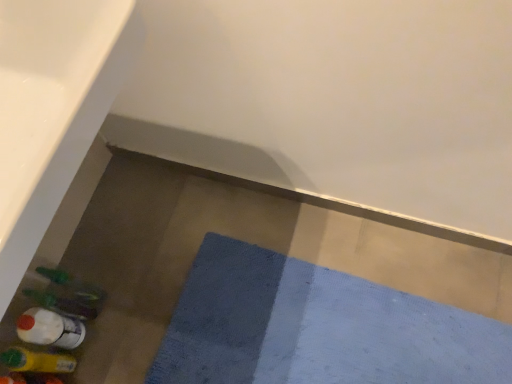
Question: Could you tell me if translucent plastic bottle at lower left, arranged as the first bottle when viewed from the top, is facing blue textured bath mat at lower center?

Choices:
 (A) no
 (B) yes

Answer: (A)

Question: Is translucent plastic bottle at lower left, the 3th bottle positioned from the bottom, taller than blue textured bath mat at lower center?

Choices:
 (A) no
 (B) yes

Answer: (B)

Question: From a real-world perspective, is translucent plastic bottle at lower left, the 3th bottle positioned from the bottom, on blue textured bath mat at lower center?

Choices:
 (A) no
 (B) yes

Answer: (B)

Question: Is translucent plastic bottle at lower left, arranged as the first bottle when viewed from the top, bigger than blue textured bath mat at lower center?

Choices:
 (A) no
 (B) yes

Answer: (A)

Question: Is translucent plastic bottle at lower left, the 3th bottle positioned from the bottom, to the right of blue textured bath mat at lower center from the viewer's perspective?

Choices:
 (A) yes
 (B) no

Answer: (B)

Question: From their relative heights in the image, would you say white glossy bath at lower left is taller or shorter than translucent plastic bottle at lower left, the second bottle when ordered from bottom to top?

Choices:
 (A) short
 (B) tall

Answer: (B)

Question: Is white glossy bath at lower left inside the boundaries of translucent plastic bottle at lower left, which is the second bottle from top to bottom, or outside?

Choices:
 (A) inside
 (B) outside

Answer: (B)

Question: Considering the positions of white glossy bath at lower left and translucent plastic bottle at lower left, the second bottle when ordered from bottom to top, in the image, is white glossy bath at lower left wider or thinner than translucent plastic bottle at lower left, the second bottle when ordered from bottom to top,?

Choices:
 (A) thin
 (B) wide

Answer: (B)

Question: Does point click(x=6, y=135) appear closer or farther from the camera than point click(x=72, y=344)?

Choices:
 (A) closer
 (B) farther

Answer: (A)

Question: Considering their positions, is white glossy bath at lower left located in front of or behind translucent plastic bottle at lower left, arranged as the first bottle when viewed from the top?

Choices:
 (A) behind
 (B) front

Answer: (B)

Question: Would you say white glossy bath at lower left is to the left or to the right of translucent plastic bottle at lower left, the 3th bottle positioned from the bottom, in the picture?

Choices:
 (A) right
 (B) left

Answer: (A)

Question: Would you say white glossy bath at lower left is inside or outside translucent plastic bottle at lower left, the 3th bottle positioned from the bottom?

Choices:
 (A) inside
 (B) outside

Answer: (B)

Question: From the image's perspective, is white glossy bath at lower left located above or below translucent plastic bottle at lower left, the 3th bottle positioned from the bottom?

Choices:
 (A) above
 (B) below

Answer: (A)

Question: Is translucent plastic bottle at lower left, arranged as the first bottle when viewed from the top, in front of or behind translucent plastic bottle at lower left, which ranks as the 3th bottle in top-to-bottom order, in the image?

Choices:
 (A) behind
 (B) front

Answer: (A)

Question: From their relative heights in the image, would you say translucent plastic bottle at lower left, arranged as the first bottle when viewed from the top, is taller or shorter than translucent plastic bottle at lower left, marked as the 1th bottle in a bottom-to-top arrangement?

Choices:
 (A) short
 (B) tall

Answer: (A)